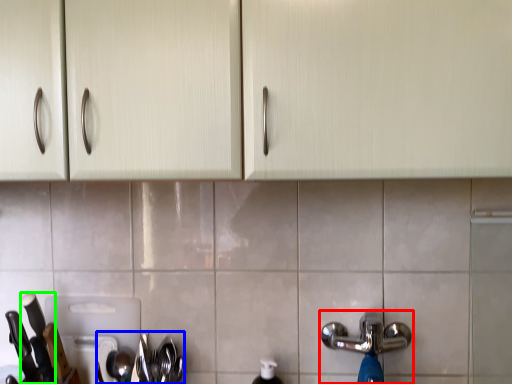
Question: Based on their relative distances, which object is nearer to tap (highlighted by a red box)? Choose from silverware (highlighted by a blue box) and knife (highlighted by a green box).

Choices:
 (A) silverware
 (B) knife

Answer: (A)